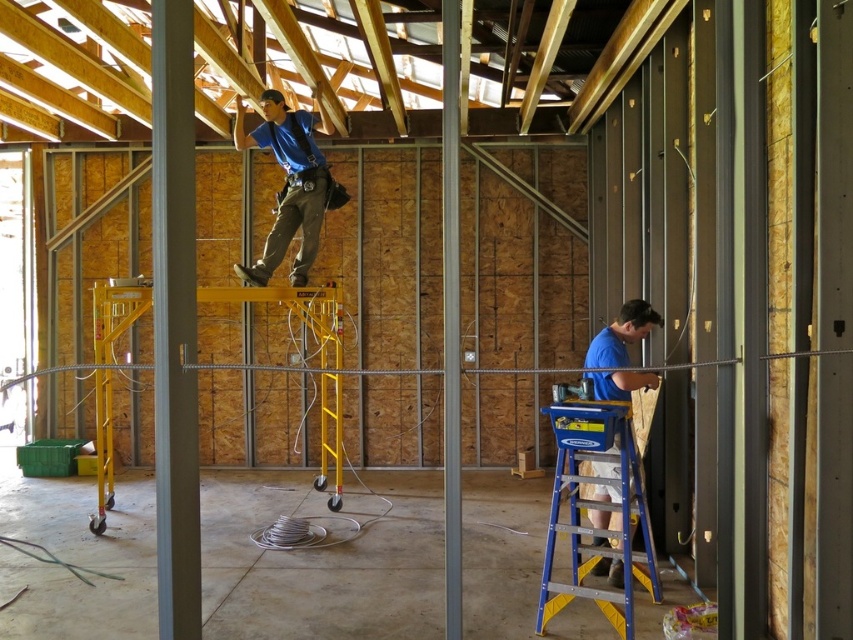
You are a safety inspector standing at the entrance of the construction site. You notice two points marked on the floor at coordinates point (x=582, y=413) and point (x=294, y=173). Which point is closer to you?

Point (x=294, y=173) is closer to you because it is behind point (x=582, y=413), meaning the latter is farther away.

You are a safety inspector observing the construction site. You notice two workers in blue shirts. The first is the blue fabric construction worker at upper center and the second is the blue matte shirt at lower right. Based on their positions, which worker is closer to the left side of the room?

The blue fabric construction worker at upper center is closer to the left side of the room because it is positioned to the left of the blue matte shirt at lower right.

You are a safety inspector at the construction site. You need to check the distance between the two points marked in the image. Which point is closer to the camera, point (100, 410) or point (608, 621)?

Point (608, 621) is closer to the camera because it is stated that point (100, 410) is further away than point (608, 621).